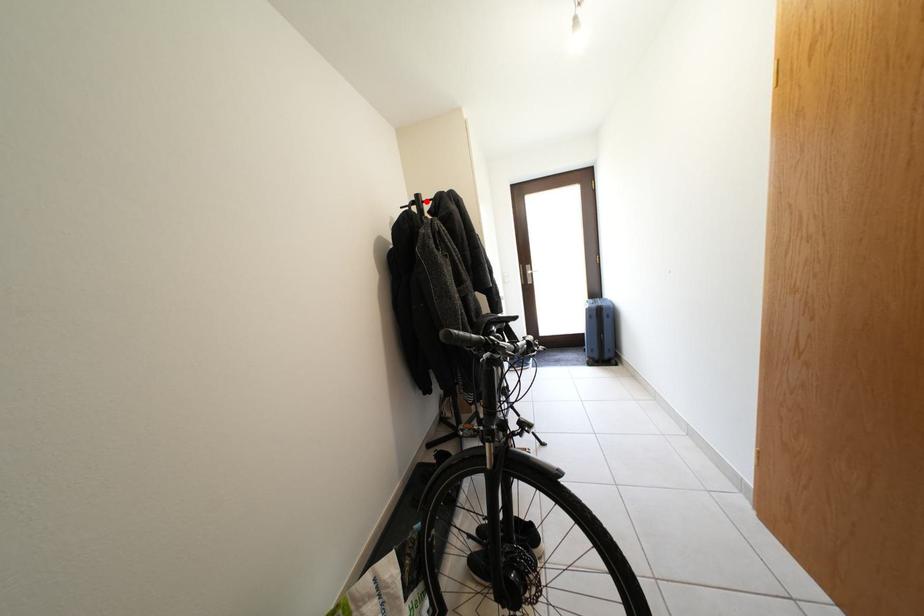
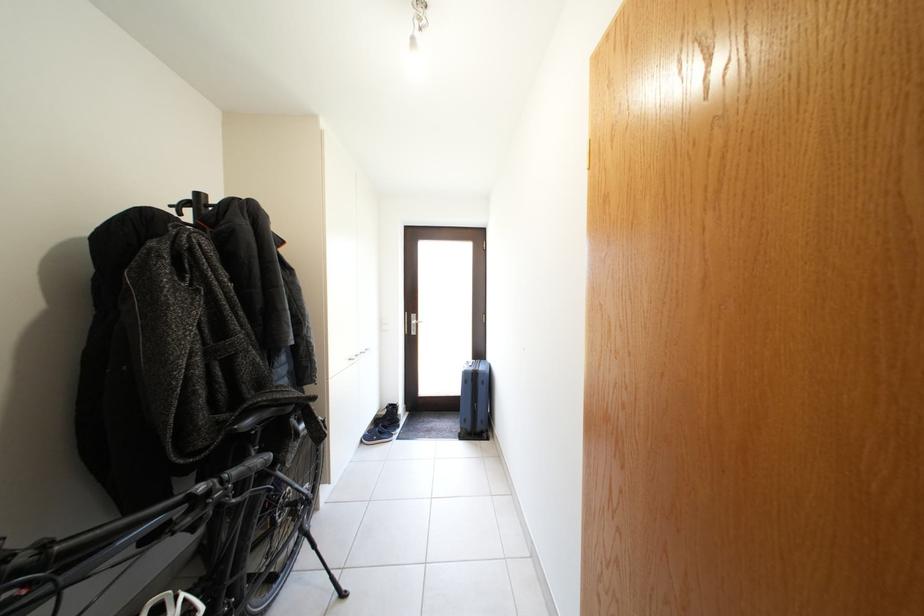
Question: I am providing you with two images of the same scene from different viewpoints. Given a red point in image1, look at the same physical point in image2. Is it:

Choices:
 (A) Closer to the viewpoint
 (B) Farther from the viewpoint

Answer: (B)